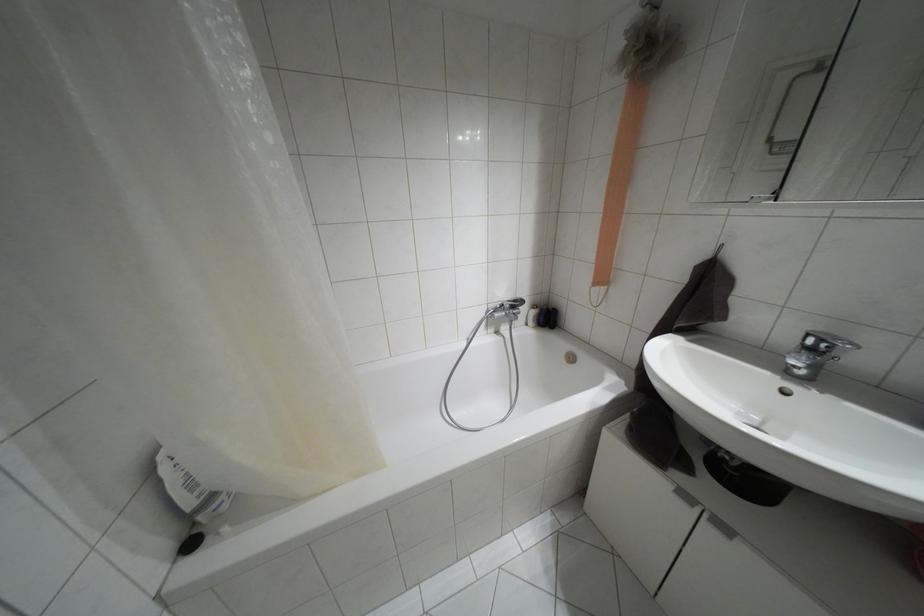
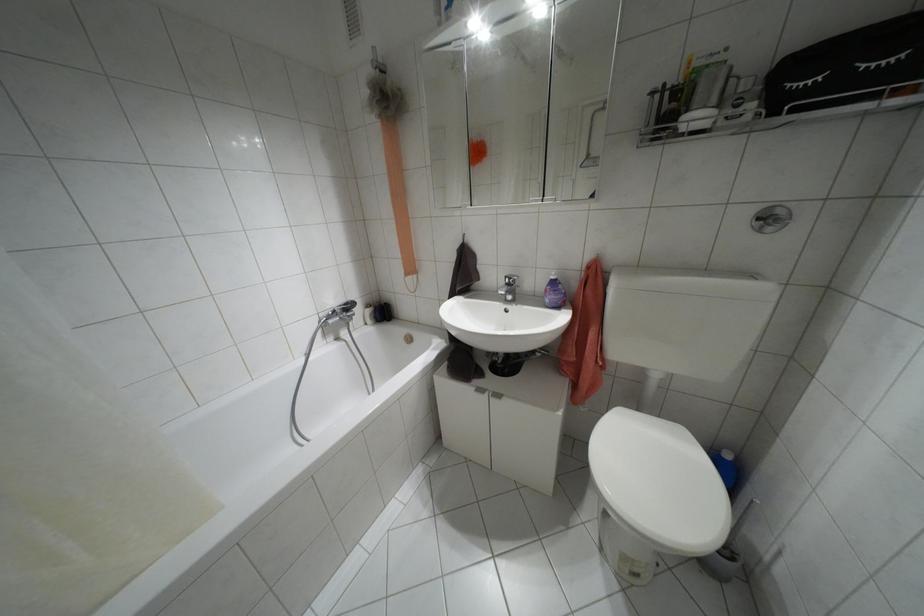
Question: The first image is from the beginning of the video and the second image is from the end. How did the camera likely rotate when shooting the video?

Choices:
 (A) Left
 (B) Right
 (C) Up
 (D) Down

Answer: (B)